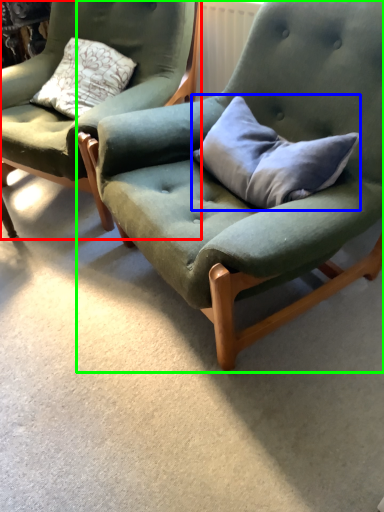
Question: Considering the real-world distances, which object is closest to chair (highlighted by a red box)? pillow (highlighted by a blue box) or chair (highlighted by a green box).

Choices:
 (A) pillow
 (B) chair

Answer: (B)